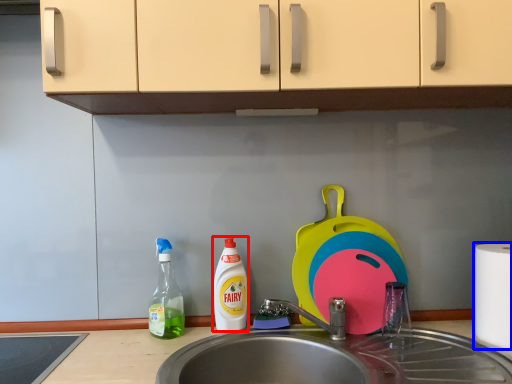
Question: Which of the following is the farthest to the observer, cleaning product (highlighted by a red box) or paper towel (highlighted by a blue box)?

Choices:
 (A) cleaning product
 (B) paper towel

Answer: (A)